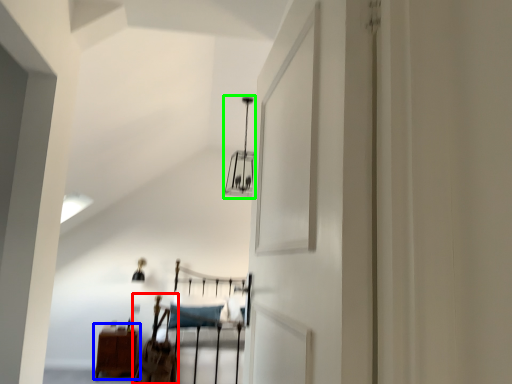
Question: Based on their relative distances, which object is farther from chair (highlighted by a red box)? Choose from furniture (highlighted by a blue box) and light fixture (highlighted by a green box).

Choices:
 (A) furniture
 (B) light fixture

Answer: (B)